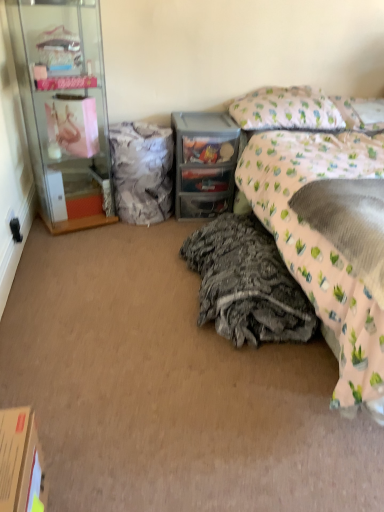
Where is `empty space that is to the right of cardboard box at lower left`? empty space that is to the right of cardboard box at lower left is located at coordinates (100, 492).